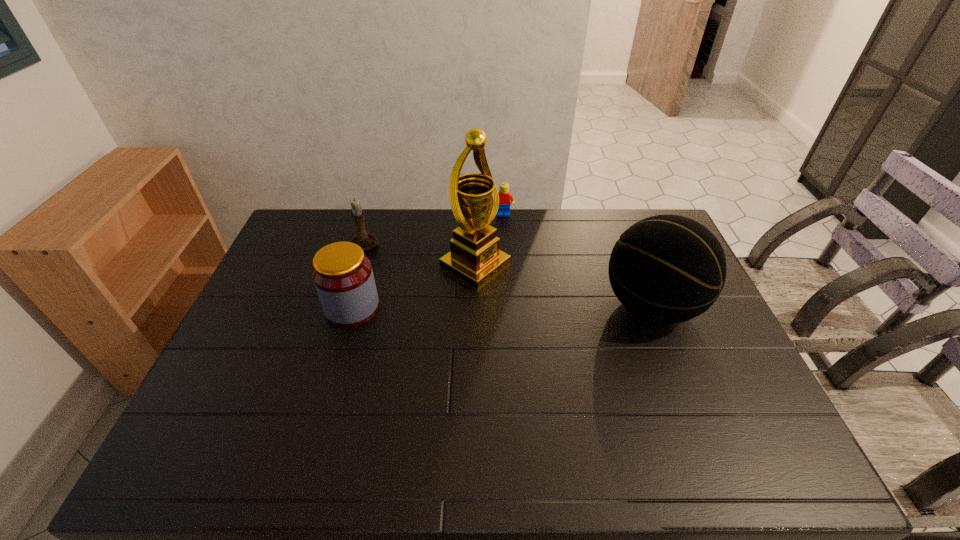
Find the location of `blank space that satisfies the following two spatial constraints: 1. on the front side of the basketball; 2. on the right side of the shortest object`. blank space that satisfies the following two spatial constraints: 1. on the front side of the basketball; 2. on the right side of the shortest object is located at coordinates (509, 306).